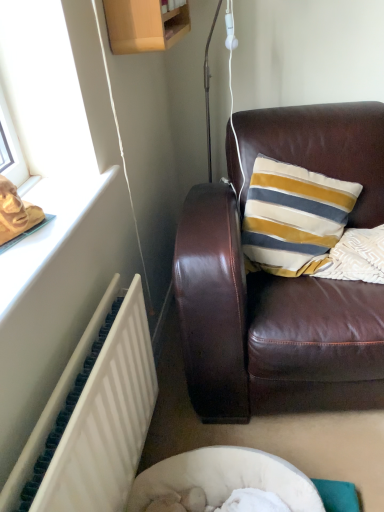
This screenshot has height=512, width=384. Describe the element at coordinates (281, 282) in the screenshot. I see `brown leather couch at center` at that location.

At what (x,y) coordinates should I click in order to perform the action: click on brown leather couch at center. Please return your answer as a coordinate pair (x, y). The width and height of the screenshot is (384, 512). Looking at the image, I should click on click(281, 282).

This screenshot has height=512, width=384. What do you see at coordinates (94, 417) in the screenshot?
I see `white textured radiator at lower left` at bounding box center [94, 417].

Where is `white textured radiator at lower left`? white textured radiator at lower left is located at coordinates (94, 417).

Find the location of a particular element. brown leather couch at center is located at coordinates tap(281, 282).

Looking at this image, considering the relative positions of white textured radiator at lower left and brown leather couch at center in the image provided, is white textured radiator at lower left to the left of brown leather couch at center from the viewer's perspective?

Indeed, white textured radiator at lower left is positioned on the left side of brown leather couch at center.

Does white textured radiator at lower left come behind brown leather couch at center?

No, white textured radiator at lower left is closer to the viewer.

Which is in front, point (80, 340) or point (256, 362)?

The point (80, 340) is closer.

From the image's perspective, which object appears higher, white textured radiator at lower left or brown leather couch at center?

brown leather couch at center appears higher in the image.

From a real-world perspective, does white textured radiator at lower left stand above brown leather couch at center?

Incorrect, from a real-world perspective, white textured radiator at lower left is lower than brown leather couch at center.

Does white textured radiator at lower left have a lesser width compared to brown leather couch at center?

Correct, the width of white textured radiator at lower left is less than that of brown leather couch at center.

Considering the sizes of objects white textured radiator at lower left and brown leather couch at center in the image provided, who is shorter, white textured radiator at lower left or brown leather couch at center?

Standing shorter between the two is white textured radiator at lower left.

Considering the sizes of objects white textured radiator at lower left and brown leather couch at center in the image provided, who is smaller, white textured radiator at lower left or brown leather couch at center?

white textured radiator at lower left is smaller.

Would you say white textured radiator at lower left is outside brown leather couch at center?

white textured radiator at lower left is positioned outside brown leather couch at center.

Can you see white textured radiator at lower left touching brown leather couch at center?

No, white textured radiator at lower left is not touching brown leather couch at center.

Based on the photo, is white textured radiator at lower left oriented towards brown leather couch at center?

No, white textured radiator at lower left is not aimed at brown leather couch at center.

This screenshot has width=384, height=512. Identify the location of studio couch on the right side of white textured radiator at lower left. (281, 282).

In the scene shown: Is brown leather couch at center to the right of white textured radiator at lower left from the viewer's perspective?

Correct, you'll find brown leather couch at center to the right of white textured radiator at lower left.

Is brown leather couch at center positioned before white textured radiator at lower left?

No, it is behind white textured radiator at lower left.

Is point (222, 335) closer or farther from the camera than point (79, 377)?

Point (222, 335) is positioned farther from the camera compared to point (79, 377).

Based on the photo, from the image's perspective, is brown leather couch at center located above or below white textured radiator at lower left?

brown leather couch at center is above white textured radiator at lower left.

From a real-world perspective, is brown leather couch at center above or below white textured radiator at lower left?

In terms of real-world spatial position, brown leather couch at center is above white textured radiator at lower left.

Considering the sizes of objects brown leather couch at center and white textured radiator at lower left in the image provided, who is thinner, brown leather couch at center or white textured radiator at lower left?

With smaller width is white textured radiator at lower left.

From their relative heights in the image, would you say brown leather couch at center is taller or shorter than white textured radiator at lower left?

brown leather couch at center is taller than white textured radiator at lower left.

Is brown leather couch at center bigger or smaller than white textured radiator at lower left?

In the image, brown leather couch at center appears to be larger than white textured radiator at lower left.

Is brown leather couch at center positioned beyond the bounds of white textured radiator at lower left?

brown leather couch at center is positioned outside white textured radiator at lower left.

Is brown leather couch at center next to white textured radiator at lower left and touching it?

There is a gap between brown leather couch at center and white textured radiator at lower left.

Is brown leather couch at center oriented away from white textured radiator at lower left?

No, brown leather couch at center is not facing the opposite direction of white textured radiator at lower left.

What's the angular difference between brown leather couch at center and white textured radiator at lower left's facing directions?

brown leather couch at center and white textured radiator at lower left are facing 84.2 degrees away from each other.

You are a GUI agent. You are given a task and a screenshot of the screen. Output one action in this format:
    pyautogui.click(x=<x>, y=<y>)
    Task: Click on the radiator directly beneath the brown leather couch at center (from a real-world perspective)
    The image size is (384, 512).
    Given the screenshot: What is the action you would take?
    pyautogui.click(x=94, y=417)

Where is `radiator in front of the brown leather couch at center`? This screenshot has width=384, height=512. radiator in front of the brown leather couch at center is located at coordinates (94, 417).

Identify the location of studio couch lying above the white textured radiator at lower left (from the image's perspective). Image resolution: width=384 pixels, height=512 pixels. (281, 282).